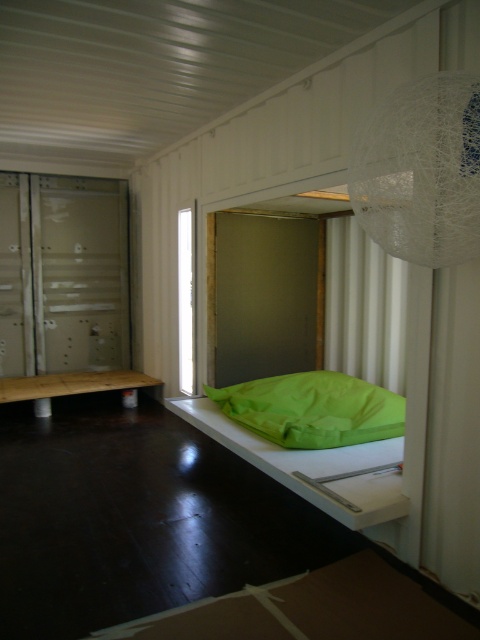
Is green fabric bed at center shorter than green fabric pillow at lower center?

No.

Is point (264, 465) closer to viewer compared to point (361, 419)?

Yes, point (264, 465) is in front of point (361, 419).

In order to click on green fabric bed at center in this screenshot , I will do `click(313, 467)`.